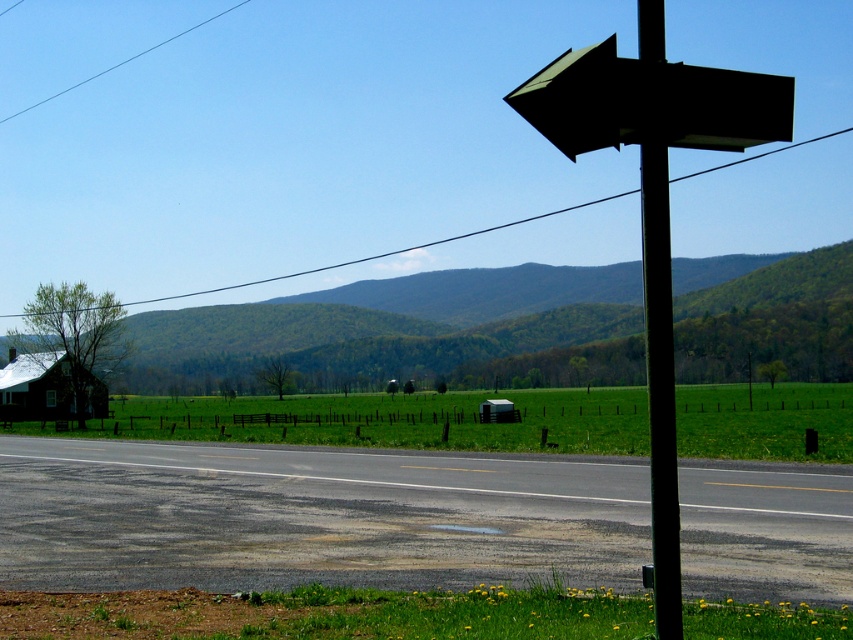
You are standing at the point marked as point (x=44, y=388) in the lower left corner of the image. Looking towards the center of the road, can you see the small dark house with the light roof to the left? Explain your answer based on the scene description.

The point marked as point (x=44, y=388) is the location of the brown wooden barn at lower left. Since the small dark house with the light roof is partially obscured by a leafless tree on the left side of the image, it might not be fully visible from the barn. However, the house is situated near the edge of the field, so parts of it could still be visible depending on the tree obstruction.

You are standing at the point closer to you in the image. Which point are you at, point (x=459, y=353) or point (x=659, y=502)?

You are at point (x=459, y=353) because it is closer to the viewer than point (x=659, y=502).

You are navigating through a rural area and see two arrows pointing directions on a sign at the upper right corner of the road. The arrows are labeled as dark green matte arrow at upper right and black matte arrow at upper right. According to the sign, which arrow is positioned lower?

The dark green matte arrow at upper right is positioned below the black matte arrow at upper right, so it is the lower one.